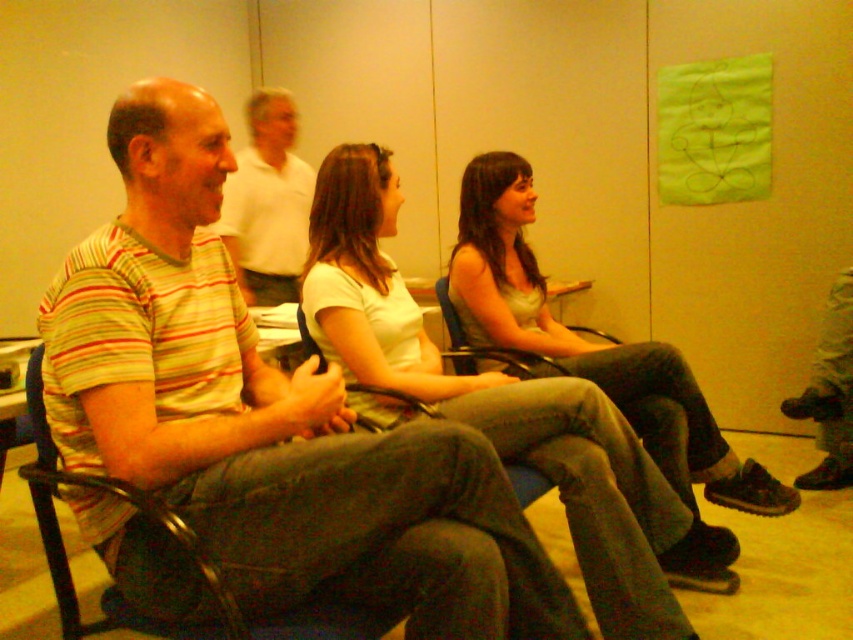
Question: Is striped cotton shirt at left further to the viewer compared to white cotton shirt at center?

Choices:
 (A) yes
 (B) no

Answer: (B)

Question: In this image, where is striped cotton shirt at left located relative to white cotton shirt at center?

Choices:
 (A) left
 (B) right

Answer: (A)

Question: Is white cotton shirt at center bigger than striped cotton shirt at center?

Choices:
 (A) yes
 (B) no

Answer: (A)

Question: Which point appears farthest from the camera in this image?

Choices:
 (A) (303, 291)
 (B) (158, 216)
 (C) (281, 109)

Answer: (C)

Question: Which of the following is the farthest from the observer?

Choices:
 (A) white cotton shirt at center
 (B) striped cotton shirt at center
 (C) striped cotton shirt at left

Answer: (B)

Question: Which of these objects is positioned closest to the striped cotton shirt at center?

Choices:
 (A) white cotton shirt at center
 (B) striped cotton shirt at left

Answer: (A)